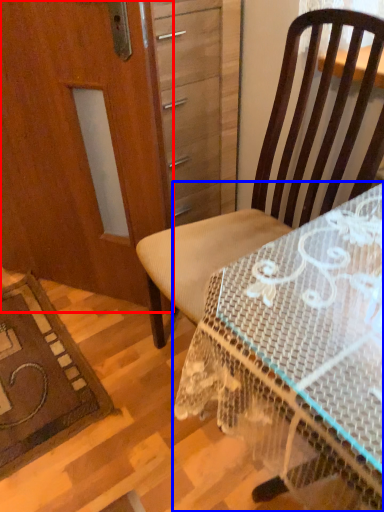
Question: Among these objects, which one is nearest to the camera, screen door (highlighted by a red box) or desk (highlighted by a blue box)?

Choices:
 (A) screen door
 (B) desk

Answer: (B)